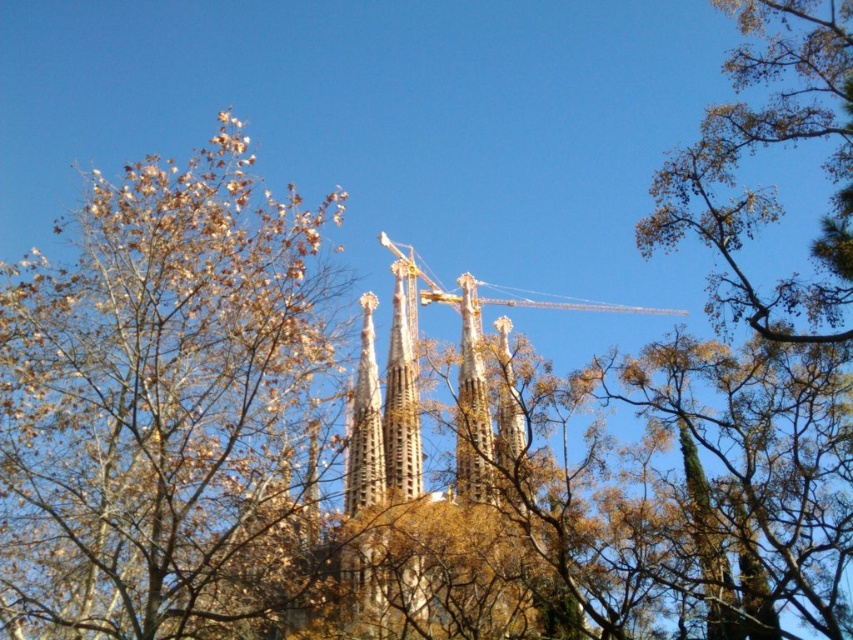
You are a photographer planning to take a picture of the Sagrada Familia. You notice two trees in the foreground, the brown leafy tree at upper left and the brown leafy tree at upper right. Which tree appears wider in the photo?

The brown leafy tree at upper left appears wider than the brown leafy tree at upper right because its width is larger according to the description.

You are a photographer planning to capture a wide shot of the Sagrada Familia. You want to ensure that both the brown leafy tree at upper left and the golden stone spire at center are fully visible in your frame. Based on their heights, which object should you position closer to the bottom of the frame to avoid cropping?

The brown leafy tree at upper left is taller than the golden stone spire at center, so you should position the brown leafy tree at upper left closer to the bottom of the frame to ensure it fits entirely within the shot without being cut off.